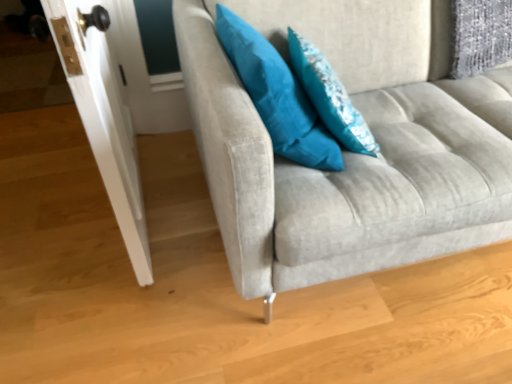
Question: Does teal fabric pillow at upper right, arranged as the second pillow when viewed from the right, lie in front of white glossy door at left?

Choices:
 (A) no
 (B) yes

Answer: (A)

Question: Is teal fabric pillow at upper right, the 1th pillow positioned from the left, not near white glossy door at left?

Choices:
 (A) no
 (B) yes

Answer: (A)

Question: Is teal fabric pillow at upper right, arranged as the second pillow when viewed from the right, further to camera compared to white glossy door at left?

Choices:
 (A) yes
 (B) no

Answer: (A)

Question: Is teal fabric pillow at upper right, the 1th pillow positioned from the left, at the right side of white glossy door at left?

Choices:
 (A) yes
 (B) no

Answer: (A)

Question: Is teal fabric pillow at upper right, the 1th pillow positioned from the left, touching white glossy door at left?

Choices:
 (A) no
 (B) yes

Answer: (A)

Question: Does point (302, 64) appear closer or farther from the camera than point (273, 150)?

Choices:
 (A) farther
 (B) closer

Answer: (A)

Question: In terms of width, does teal fabric pillow at upper center, positioned as the first pillow in right-to-left order, look wider or thinner when compared to teal fabric pillow at upper right, the 1th pillow positioned from the left?

Choices:
 (A) thin
 (B) wide

Answer: (A)

Question: Is teal fabric pillow at upper center, the 2th pillow from the left, situated inside teal fabric pillow at upper right, the 1th pillow positioned from the left, or outside?

Choices:
 (A) inside
 (B) outside

Answer: (B)

Question: Is teal fabric pillow at upper center, positioned as the first pillow in right-to-left order, in front of or behind teal fabric pillow at upper right, arranged as the second pillow when viewed from the right, in the image?

Choices:
 (A) behind
 (B) front

Answer: (A)

Question: Does point (105, 168) appear closer or farther from the camera than point (305, 153)?

Choices:
 (A) farther
 (B) closer

Answer: (B)

Question: Based on their sizes in the image, would you say white glossy door at left is bigger or smaller than teal fabric pillow at upper right, the 1th pillow positioned from the left?

Choices:
 (A) big
 (B) small

Answer: (A)

Question: From a real-world perspective, is white glossy door at left above or below teal fabric pillow at upper right, arranged as the second pillow when viewed from the right?

Choices:
 (A) below
 (B) above

Answer: (A)

Question: In the image, is white glossy door at left positioned in front of or behind teal fabric pillow at upper right, the 1th pillow positioned from the left?

Choices:
 (A) behind
 (B) front

Answer: (B)

Question: Looking at the image, does teal fabric pillow at upper center, positioned as the first pillow in right-to-left order, seem bigger or smaller compared to white glossy door at left?

Choices:
 (A) big
 (B) small

Answer: (B)

Question: Considering their positions, is teal fabric pillow at upper center, positioned as the first pillow in right-to-left order, located in front of or behind white glossy door at left?

Choices:
 (A) behind
 (B) front

Answer: (A)